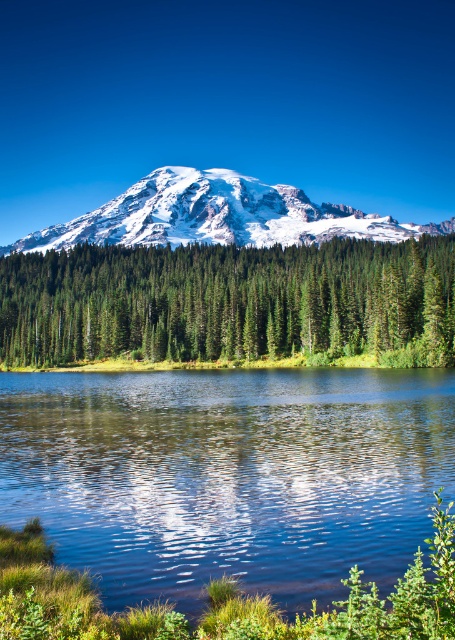
You are standing at the edge of the lake and see the clear water at center and the green matte tree at center. Which object is positioned to the left of the other?

The clear water at center is positioned to the left of the green matte tree at center.

You are standing at the edge of the lake and see the green matte tree at center and the snowy white mountain at upper center. Which object is closer to your left side?

The green matte tree at center is positioned on the left side of the snowy white mountain at upper center, so it is closer to your left side.

You are standing at the edge of the lake in the serene landscape. There are two points marked in the scene. Which point, point (441, 464) or point (299, 241), is closer to you?

Point (441, 464) is closer to the viewer than point (299, 241).